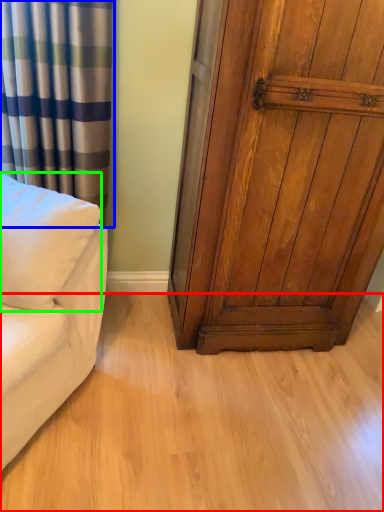
Question: Which is farther away from plain (highlighted by a red box)? curtain (highlighted by a blue box) or pillow (highlighted by a green box)?

Choices:
 (A) curtain
 (B) pillow

Answer: (A)